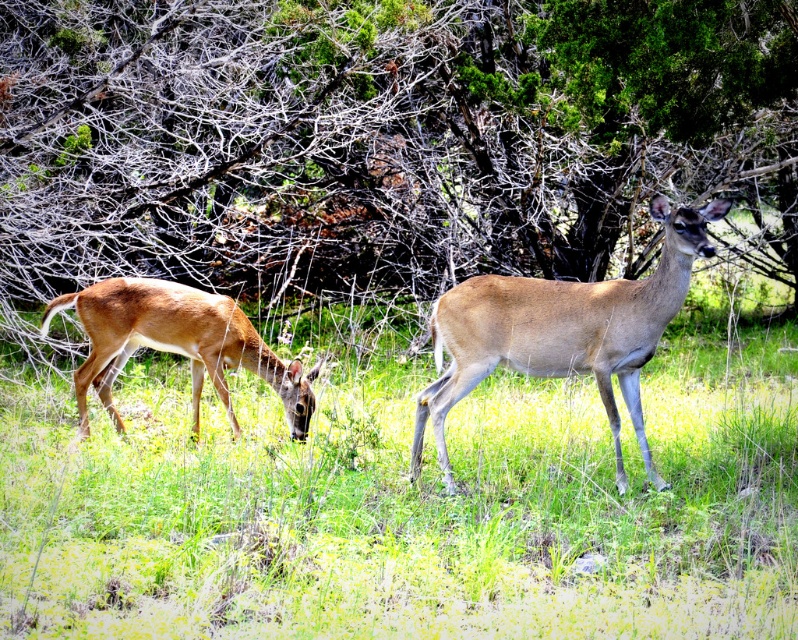
Question: Which point appears farthest from the camera in this image?

Choices:
 (A) (532, 202)
 (B) (583, 342)
 (C) (243, 324)
 (D) (693, 477)

Answer: (A)

Question: Based on their relative distances, which object is farther from the brown fur deer at center?

Choices:
 (A) shiny brown deer at left
 (B) green leafy tree at center
 (C) brown matte/deer at center

Answer: (B)

Question: Is green leafy tree at center bigger than brown fur deer at center?

Choices:
 (A) no
 (B) yes

Answer: (B)

Question: Does brown matte/deer at center have a greater width compared to shiny brown deer at left?

Choices:
 (A) yes
 (B) no

Answer: (B)

Question: In this image, where is green leafy tree at center located relative to shiny brown deer at left?

Choices:
 (A) left
 (B) right

Answer: (B)

Question: Which object is the closest to the brown matte/deer at center?

Choices:
 (A) green leafy tree at center
 (B) shiny brown deer at left
 (C) brown fur deer at center

Answer: (C)